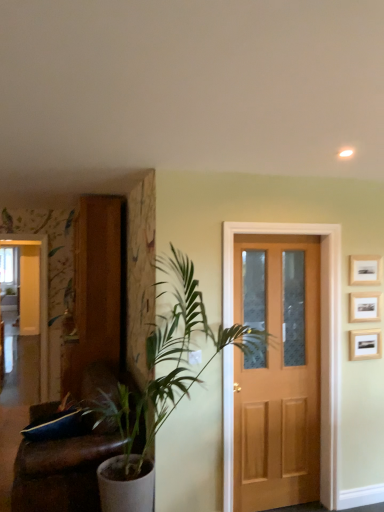
Question: From a real-world perspective, is light brown wood door at center physically below brown leather couch at left?

Choices:
 (A) no
 (B) yes

Answer: (A)

Question: Is light brown wood door at center facing towards brown leather couch at left?

Choices:
 (A) yes
 (B) no

Answer: (B)

Question: Is light brown wood door at center at the left side of brown leather couch at left?

Choices:
 (A) no
 (B) yes

Answer: (A)

Question: Considering the relative positions of light brown wood door at center and brown leather couch at left in the image provided, is light brown wood door at center to the right of brown leather couch at left from the viewer's perspective?

Choices:
 (A) yes
 (B) no

Answer: (A)

Question: Is light brown wood door at center closer to the viewer compared to brown leather couch at left?

Choices:
 (A) yes
 (B) no

Answer: (B)

Question: Is light brown wood door at center positioned behind brown leather couch at left?

Choices:
 (A) yes
 (B) no

Answer: (A)

Question: Considering the relative positions of green leafy plant at left and white glossy elevator at left in the image provided, is green leafy plant at left behind white glossy elevator at left?

Choices:
 (A) no
 (B) yes

Answer: (A)

Question: Would you say green leafy plant at left contains white glossy elevator at left?

Choices:
 (A) yes
 (B) no

Answer: (B)

Question: Does green leafy plant at left appear on the left side of white glossy elevator at left?

Choices:
 (A) no
 (B) yes

Answer: (A)

Question: From the image's perspective, is green leafy plant at left over white glossy elevator at left?

Choices:
 (A) no
 (B) yes

Answer: (A)

Question: Considering the relative sizes of green leafy plant at left and white glossy elevator at left in the image provided, is green leafy plant at left thinner than white glossy elevator at left?

Choices:
 (A) yes
 (B) no

Answer: (B)

Question: Can you confirm if green leafy plant at left is shorter than white glossy elevator at left?

Choices:
 (A) yes
 (B) no

Answer: (A)

Question: Considering the relative sizes of wooden picture frame at upper right, placed as the second picture frame when sorted from top to bottom, and wooden picture frame at upper right, the 1th picture frame when ordered from top to bottom, in the image provided, is wooden picture frame at upper right, placed as the second picture frame when sorted from top to bottom, taller than wooden picture frame at upper right, the 1th picture frame when ordered from top to bottom,?

Choices:
 (A) no
 (B) yes

Answer: (B)